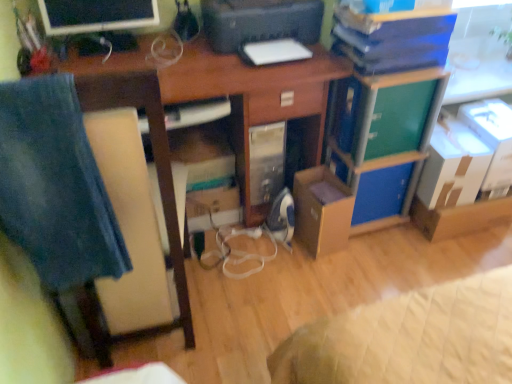
Identify the location of vacant space in front of brown cardboard box at center, arranged as the 1th cardboard box when viewed from the left. (327, 270).